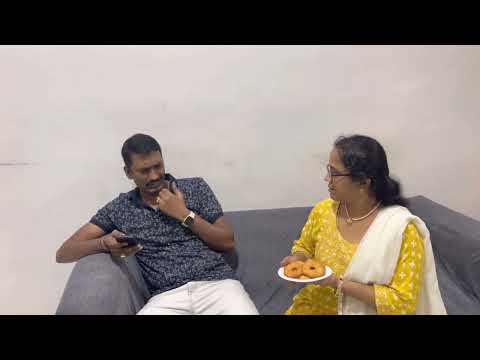
Locate an element on the screen. plate is located at coordinates (303, 280).